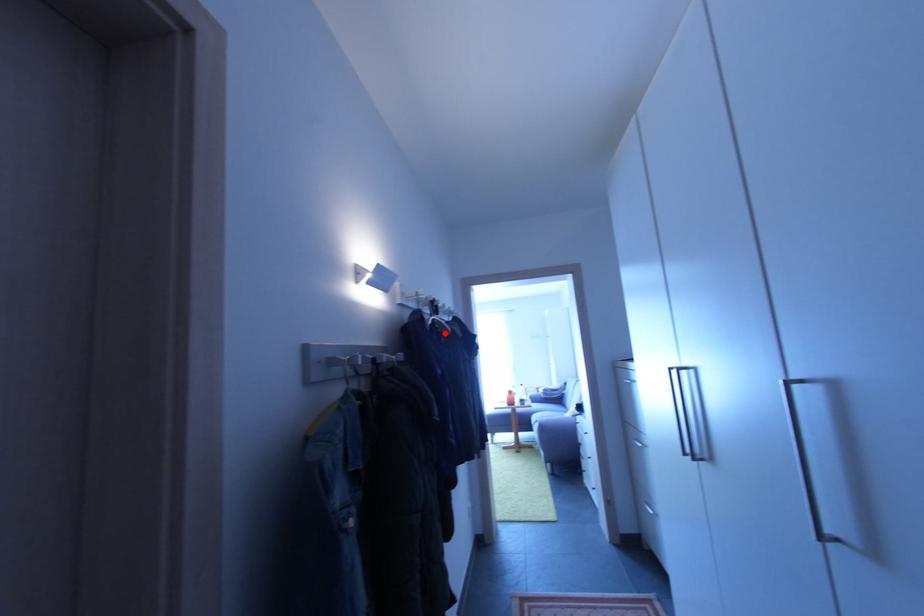
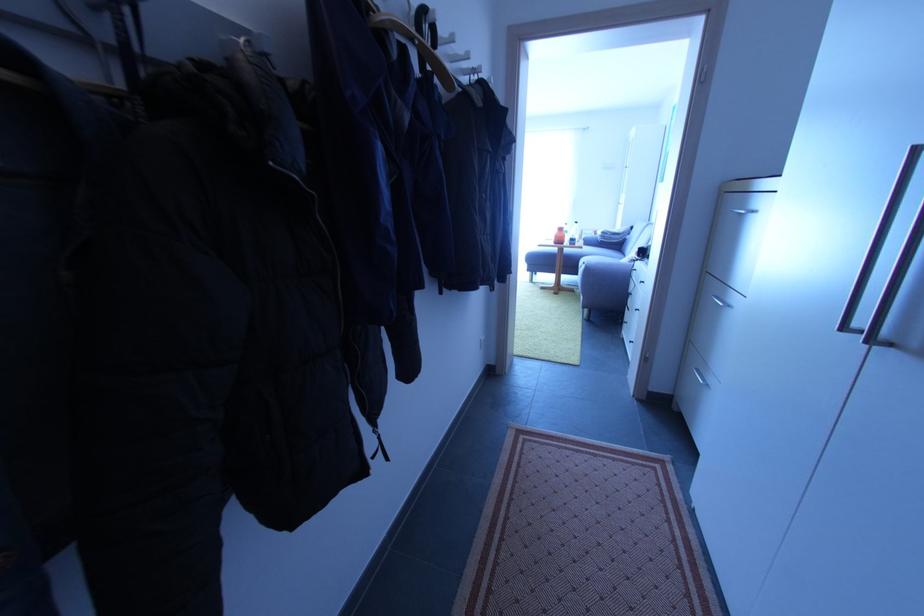
The point at the highlighted location is marked in the first image. Where is the corresponding point in the second image?

(441, 82)